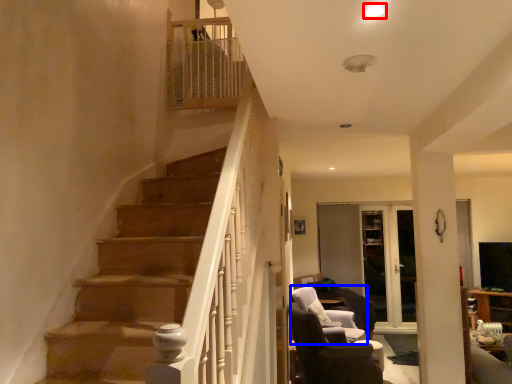
Question: Which of the following is the farthest to the observer, light (highlighted by a red box) or chair (highlighted by a blue box)?

Choices:
 (A) light
 (B) chair

Answer: (B)